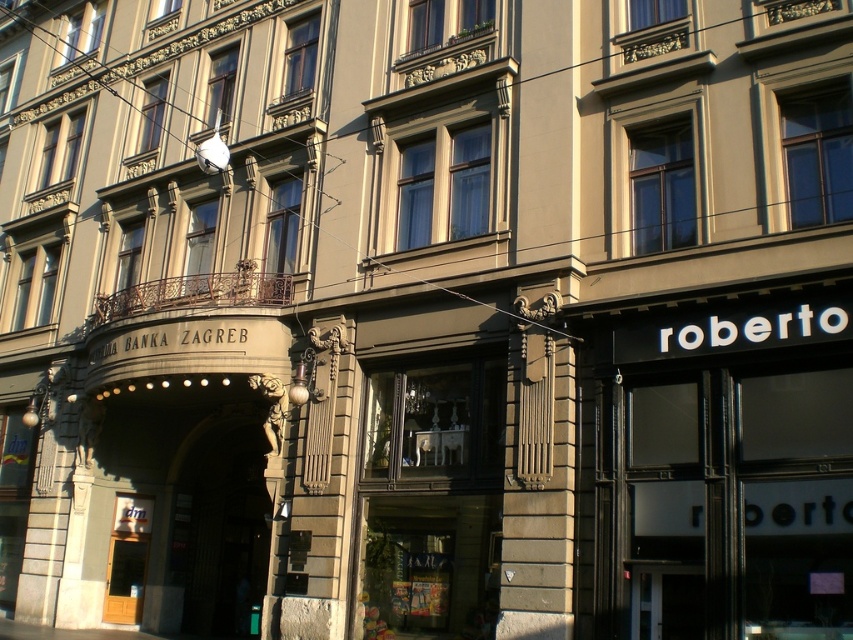
Question: Is black glass door at right wider than matte glass window at center?

Choices:
 (A) yes
 (B) no

Answer: (A)

Question: Can you confirm if black glass door at right is wider than matte glass window at center?

Choices:
 (A) yes
 (B) no

Answer: (A)

Question: Is black glass door at right above matte glass window at center?

Choices:
 (A) no
 (B) yes

Answer: (B)